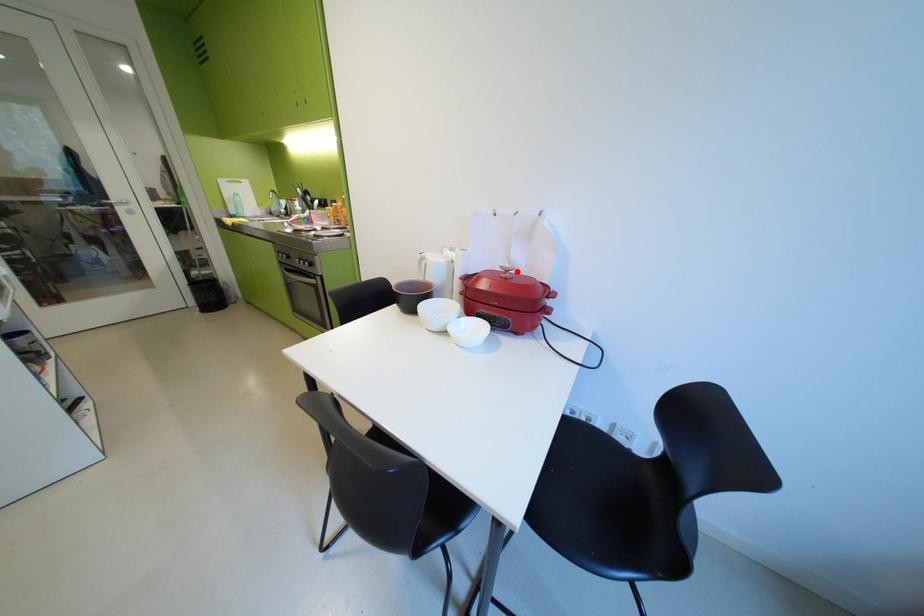
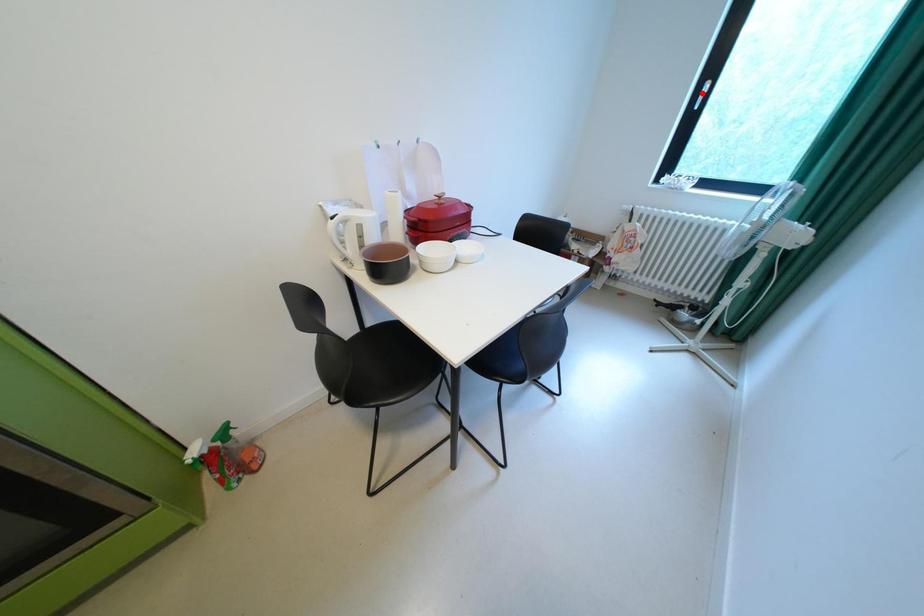
I am providing you with two images of the same scene from different viewpoints. A red point is marked on the first image and another point is marked on the second image. Is the marked point in image1 the same physical position as the marked point in image2?

No